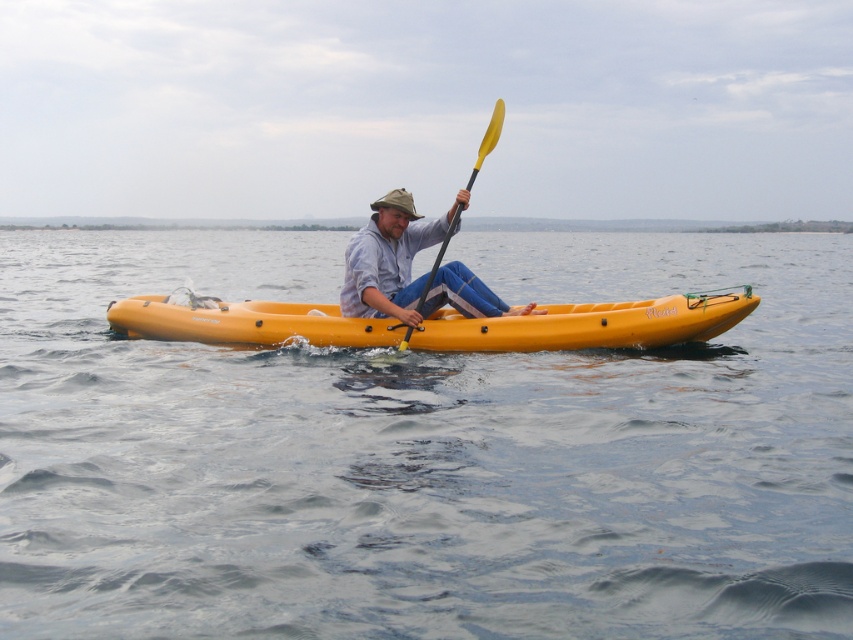
Looking at this image, which is below, matte blue jeans at center or yellow matte paddle at center?

matte blue jeans at center is lower down.

Can you confirm if matte blue jeans at center is smaller than yellow matte paddle at center?

Correct, matte blue jeans at center occupies less space than yellow matte paddle at center.

Which is in front, point (372, 216) or point (483, 156)?

Point (483, 156) is more forward.

Locate an element on the screen. Image resolution: width=853 pixels, height=640 pixels. matte blue jeans at center is located at coordinates (390, 259).

Does point (183, 333) come in front of point (346, 272)?

No, (183, 333) is further to viewer.

Is yellow matte kayak at center smaller than matte blue jeans at center?

No, yellow matte kayak at center is not smaller than matte blue jeans at center.

Is point (436, 312) positioned before point (373, 232)?

No.

The image size is (853, 640). Find the location of `yellow matte kayak at center`. yellow matte kayak at center is located at coordinates (590, 324).

Can you confirm if transparent water at center is smaller than yellow matte paddle at center?

Yes.

Is transparent water at center taller than yellow matte paddle at center?

In fact, transparent water at center may be shorter than yellow matte paddle at center.

Does point (641, 444) come farther from viewer compared to point (468, 184)?

That is False.

Image resolution: width=853 pixels, height=640 pixels. I want to click on transparent water at center, so click(424, 451).